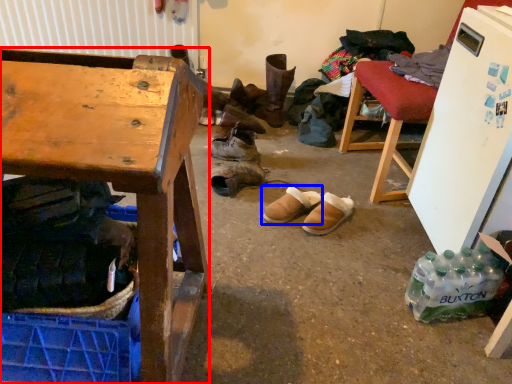
Question: Among these objects, which one is farthest to the camera, desk (highlighted by a red box) or footwear (highlighted by a blue box)?

Choices:
 (A) desk
 (B) footwear

Answer: (B)